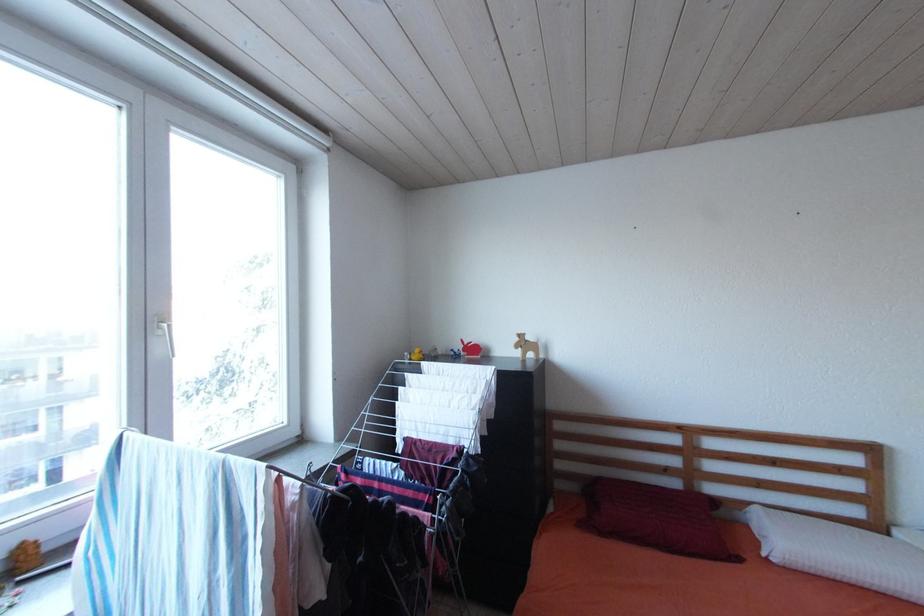
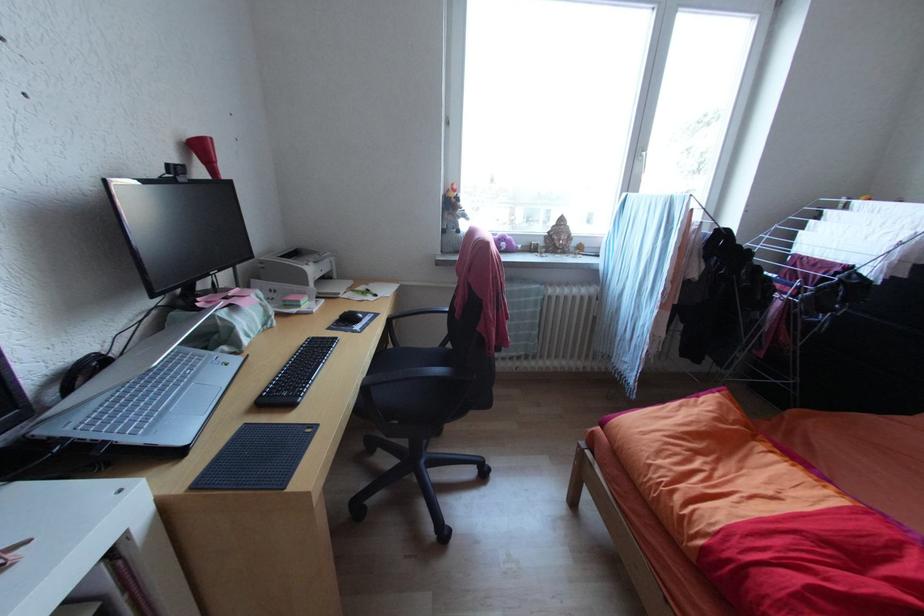
Based on the continuous images, in which direction is the camera rotating?

The camera rotated toward left-down.